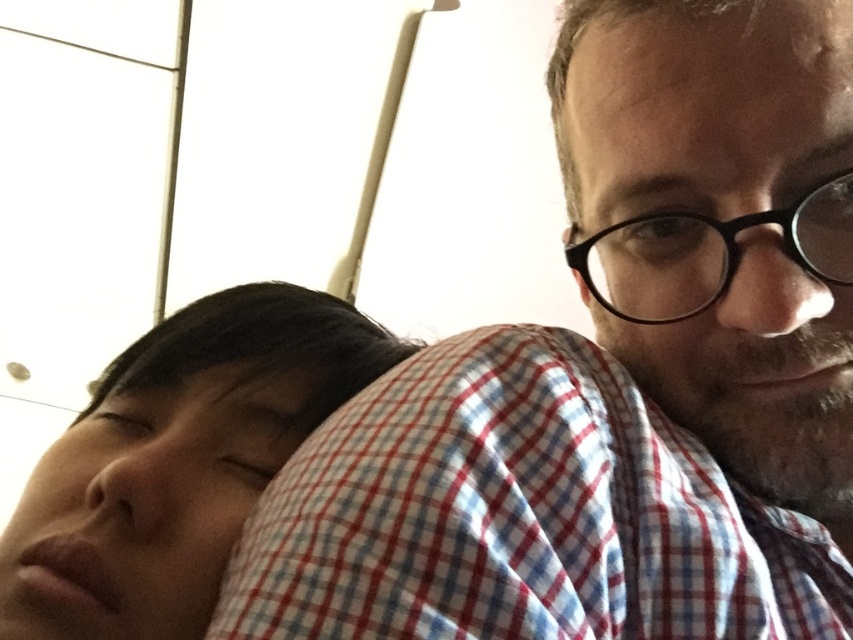
Can you confirm if red checkered fabric pillow at upper center is positioned below black plastic glasses at upper right?

Indeed, red checkered fabric pillow at upper center is positioned under black plastic glasses at upper right.

Is red checkered fabric pillow at upper center smaller than black plastic glasses at upper right?

No.

This screenshot has width=853, height=640. Describe the element at coordinates (521, 515) in the screenshot. I see `red checkered fabric pillow at upper center` at that location.

Where is `red checkered fabric pillow at upper center`? The width and height of the screenshot is (853, 640). red checkered fabric pillow at upper center is located at coordinates (521, 515).

Is smooth skin face at lower left bigger than black plastic glasses at upper right?

Yes, smooth skin face at lower left is bigger than black plastic glasses at upper right.

Identify the location of smooth skin face at lower left. (177, 461).

Who is more forward, (x=163, y=369) or (x=820, y=253)?

Positioned in front is point (x=820, y=253).

Identify the location of smooth skin face at lower left. (177, 461).

Between red checkered fabric pillow at upper center and matte checkered shirt at right, which one has less height?

red checkered fabric pillow at upper center is shorter.

At what (x,y) coordinates should I click in order to perform the action: click on red checkered fabric pillow at upper center. Please return your answer as a coordinate pair (x, y). Looking at the image, I should click on (521, 515).